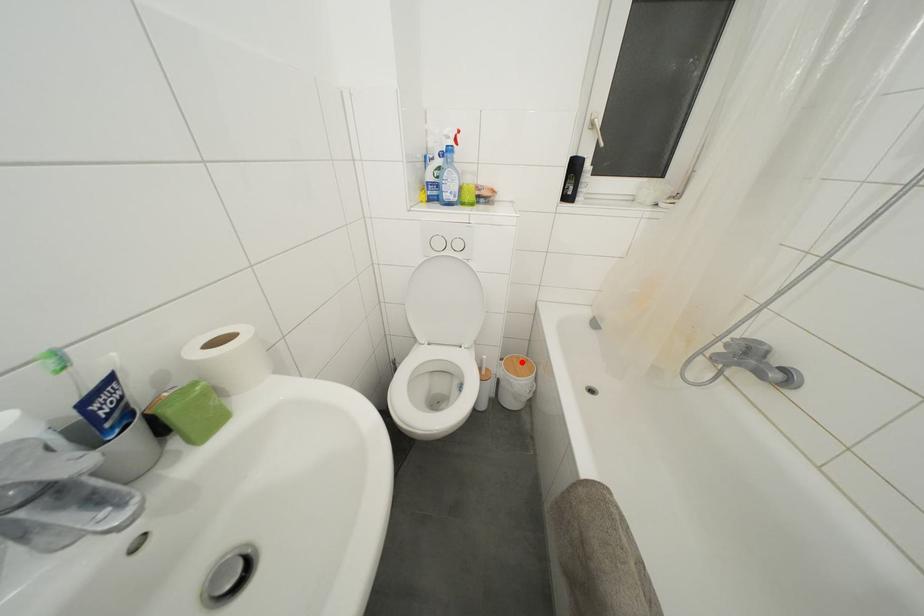
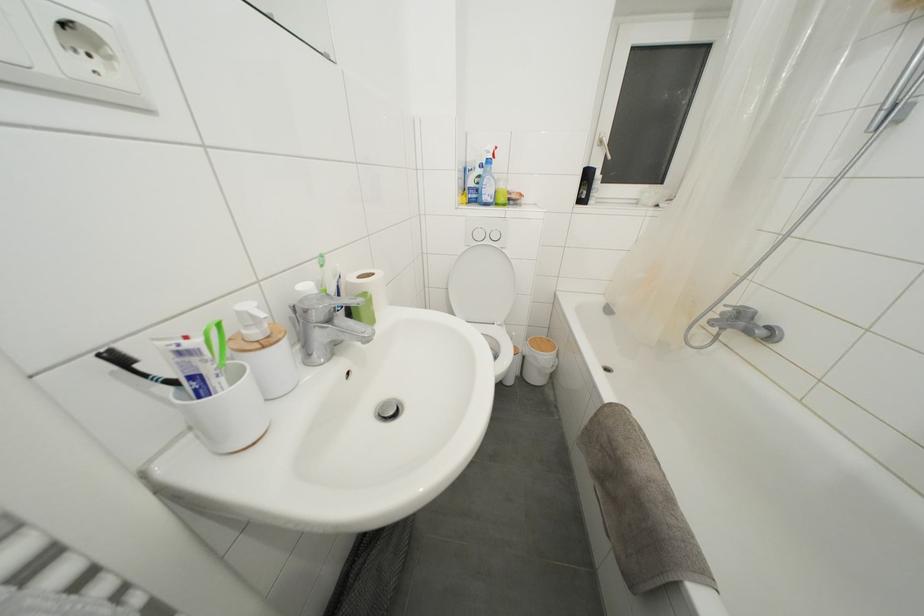
The point at the highlighted location is marked in the first image. Where is the corresponding point in the second image?

(544, 342)